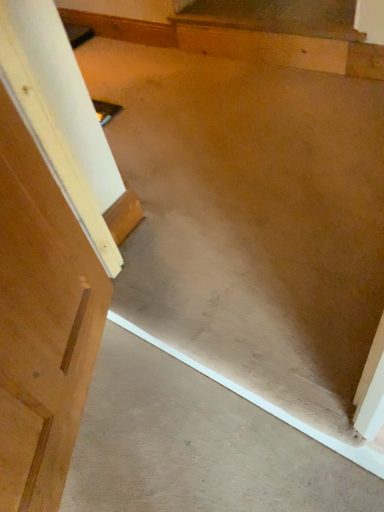
I want to click on gray matte concrete at center, so 196,446.

Describe the element at coordinates (196, 446) in the screenshot. I see `gray matte concrete at center` at that location.

Find the location of a particular element. Image resolution: width=384 pixels, height=512 pixels. gray matte concrete at center is located at coordinates (196, 446).